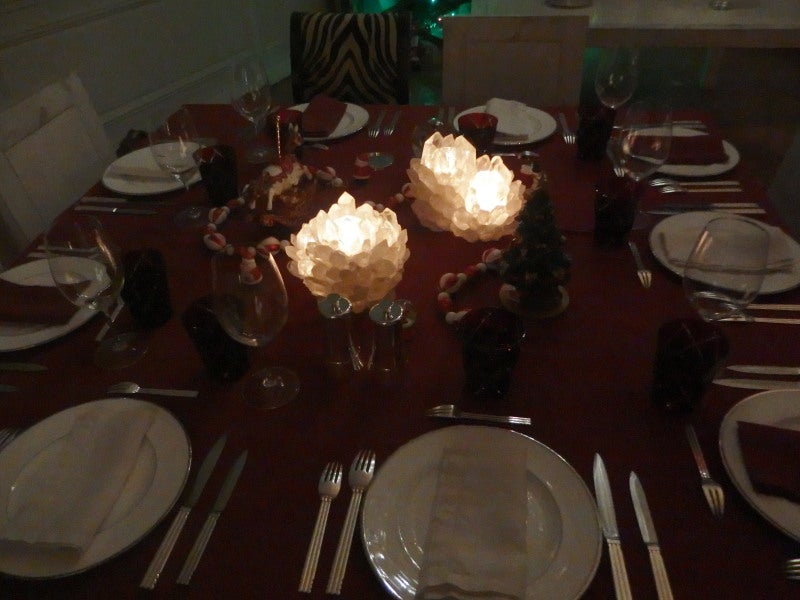
Find the location of `plates with white napkins`. plates with white napkins is located at coordinates (96, 468), (481, 512), (682, 246), (512, 122), (153, 166).